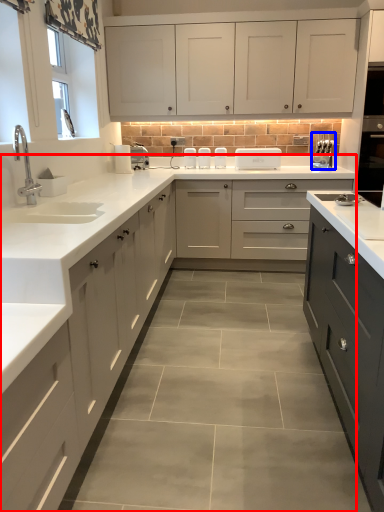
Question: Which object is further to the camera taking this photo, countertop (highlighted by a red box) or appliance (highlighted by a blue box)?

Choices:
 (A) countertop
 (B) appliance

Answer: (B)